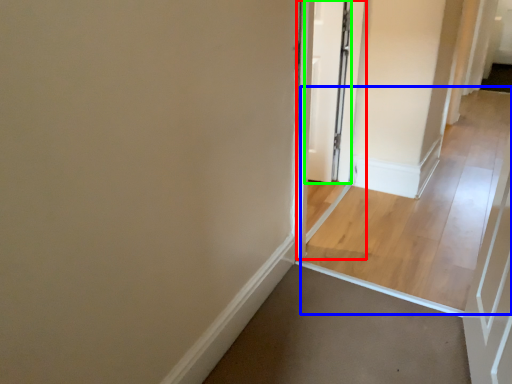
Question: Considering the real-world distances, which object is farthest from screen door (highlighted by a red box)? path (highlighted by a blue box) or door (highlighted by a green box)?

Choices:
 (A) path
 (B) door

Answer: (A)